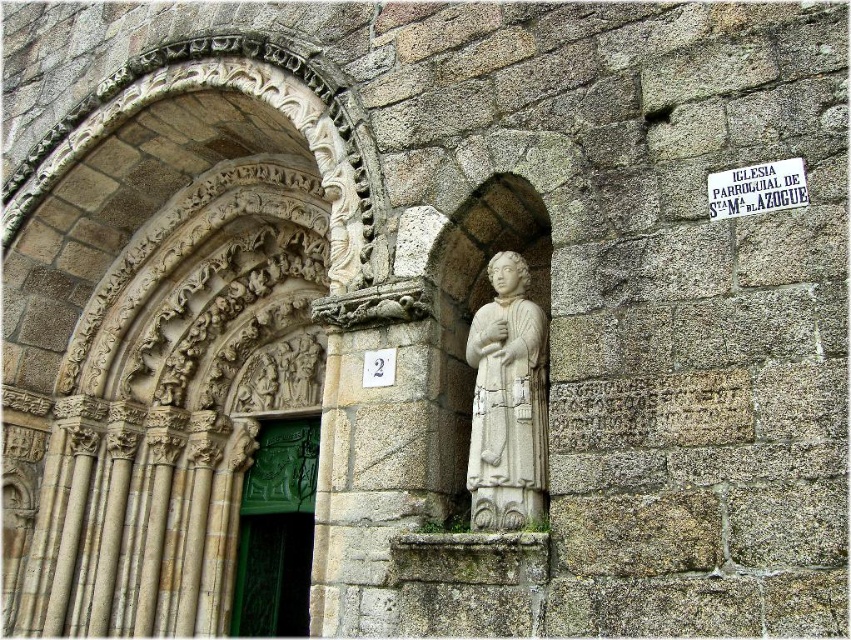
Question: Does white stone statue at center come in front of white paper sign at upper center?

Choices:
 (A) no
 (B) yes

Answer: (A)

Question: Which point appears farthest from the camera in this image?

Choices:
 (A) (286, 444)
 (B) (740, 196)
 (C) (483, 428)

Answer: (A)

Question: Does white stone statue at center have a smaller size compared to white paper sign at upper center?

Choices:
 (A) yes
 (B) no

Answer: (B)

Question: Among these objects, which one is nearest to the camera?

Choices:
 (A) white stone statue at center
 (B) green carved wood door at center

Answer: (A)

Question: Does green carved wood door at center appear over white paper sign at upper center?

Choices:
 (A) yes
 (B) no

Answer: (B)

Question: Estimate the real-world distances between objects in this image. Which object is farther from the white stone statue at center?

Choices:
 (A) green carved wood door at center
 (B) white paper sign at upper center

Answer: (A)